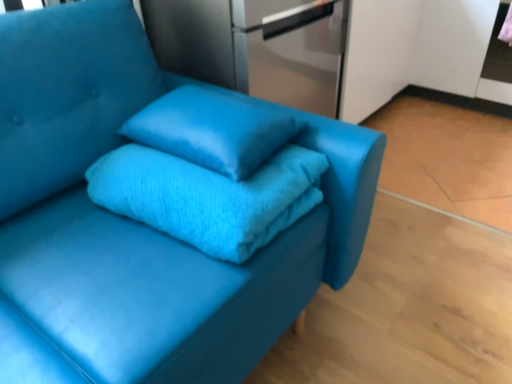
Locate an element on the screen. This screenshot has height=384, width=512. empty space that is ontop of matte blue pillow at center (from a real-world perspective) is located at coordinates 218,124.